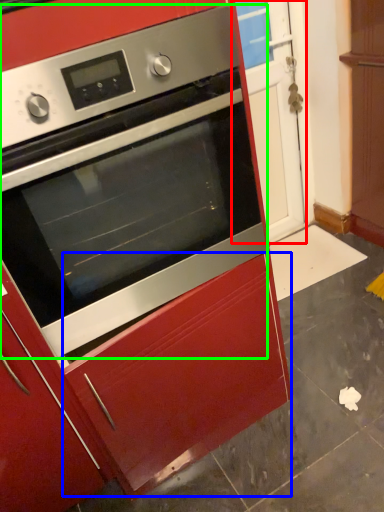
Question: Considering the real-world distances, which object is closest to glass door (highlighted by a red box)? drawer (highlighted by a blue box) or oven (highlighted by a green box).

Choices:
 (A) drawer
 (B) oven

Answer: (B)